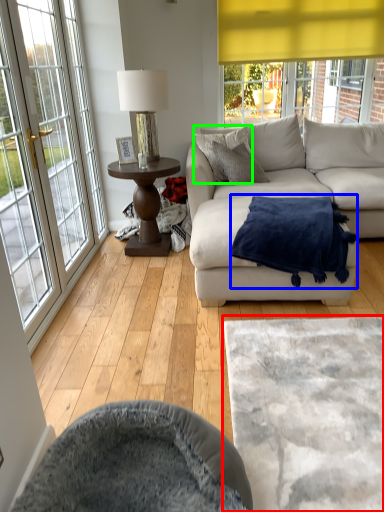
Question: Estimate the real-world distances between objects in this image. Which object is closer to cat bed (highlighted by a red box), blanket (highlighted by a blue box) or pillow (highlighted by a green box)?

Choices:
 (A) blanket
 (B) pillow

Answer: (A)